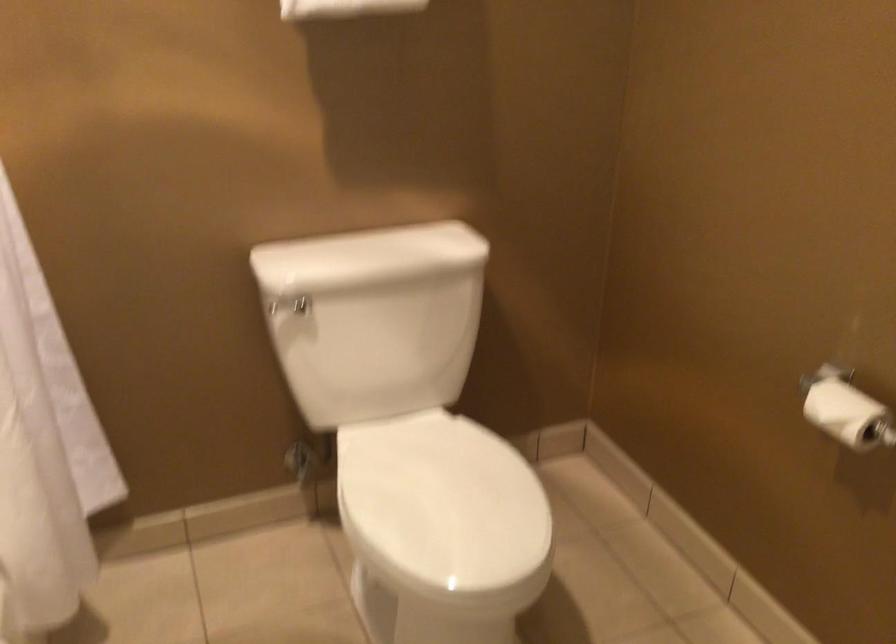
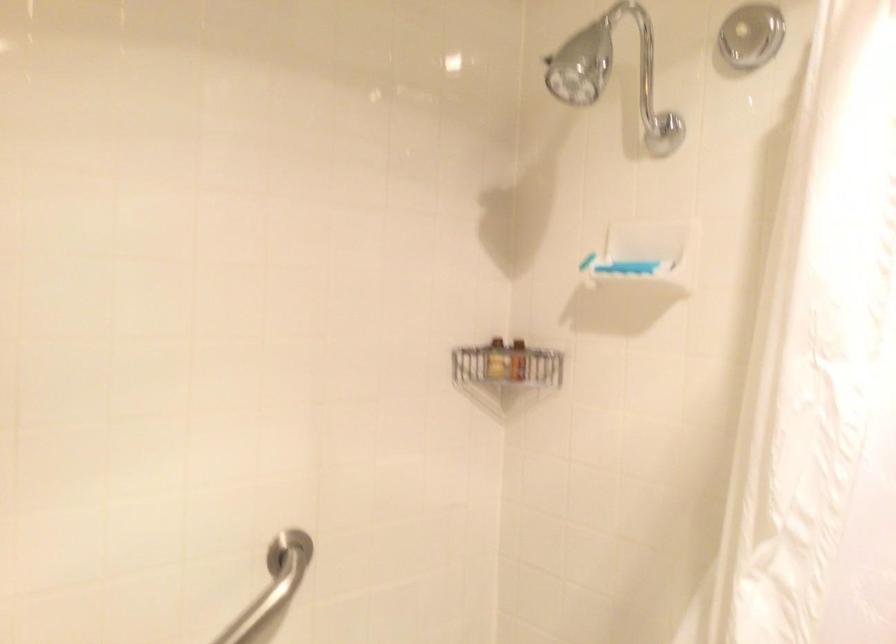
Question: Based on the continuous images, in which direction is the camera rotating? Reply with the corresponding letter.

Choices:
 (A) Left
 (B) Right
 (C) Up
 (D) Down

Answer: (A)